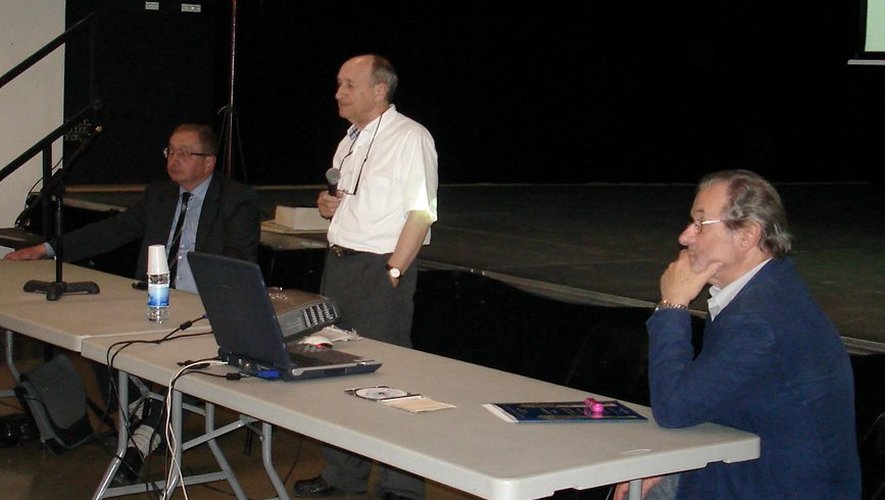
Find the location of a particular element. The height and width of the screenshot is (500, 885). wires is located at coordinates (180, 387).